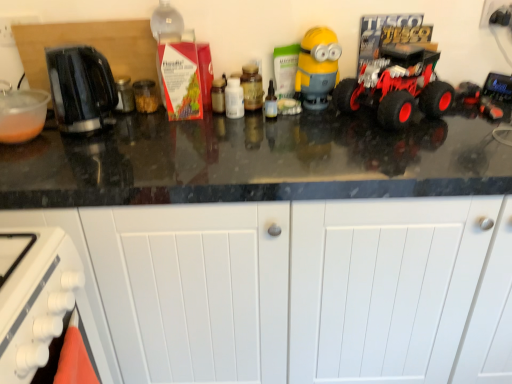
This screenshot has width=512, height=384. What are the coordinates of `free space that is to the left of white plastic bottle at center, marked as the 1th bottle in a left-to-right arrangement` in the screenshot? It's located at (x=195, y=119).